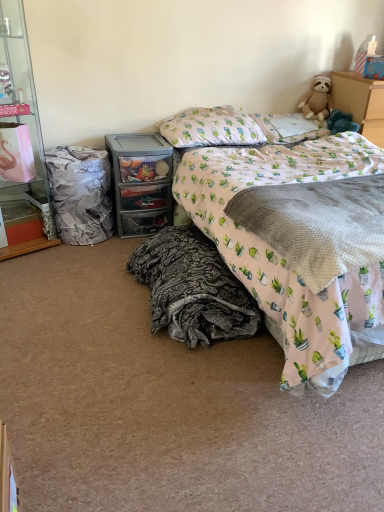
Identify the location of vacant space in front of clear glass cabinet at left. (29, 272).